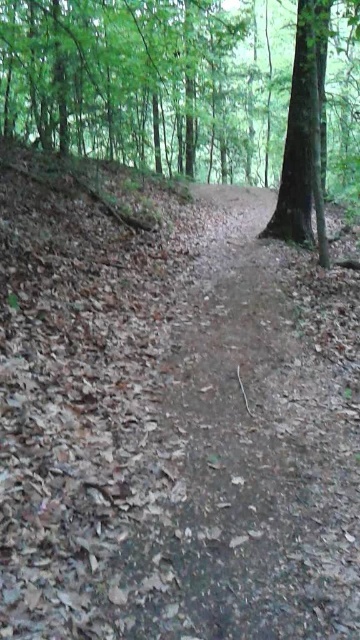
Does green leafy tree at upper center come in front of green rough bark tree at upper right?

No, green leafy tree at upper center is further to the viewer.

Who is more forward, (51, 12) or (293, 205)?

Positioned in front is point (293, 205).

Is point (65, 0) in front of point (313, 97)?

No, (65, 0) is further to viewer.

Where is `green leafy tree at upper center`? The height and width of the screenshot is (640, 360). green leafy tree at upper center is located at coordinates (168, 88).